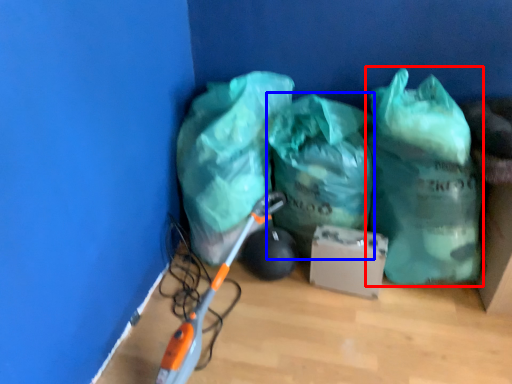
Question: Which of the following is the farthest to the observer, plastic bag (highlighted by a red box) or plastic bag (highlighted by a blue box)?

Choices:
 (A) plastic bag
 (B) plastic bag

Answer: (B)